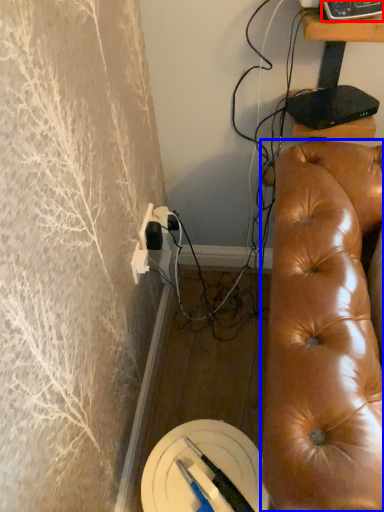
Question: Which of the following is the farthest to the observer, equipment (highlighted by a red box) or studio couch (highlighted by a blue box)?

Choices:
 (A) equipment
 (B) studio couch

Answer: (A)